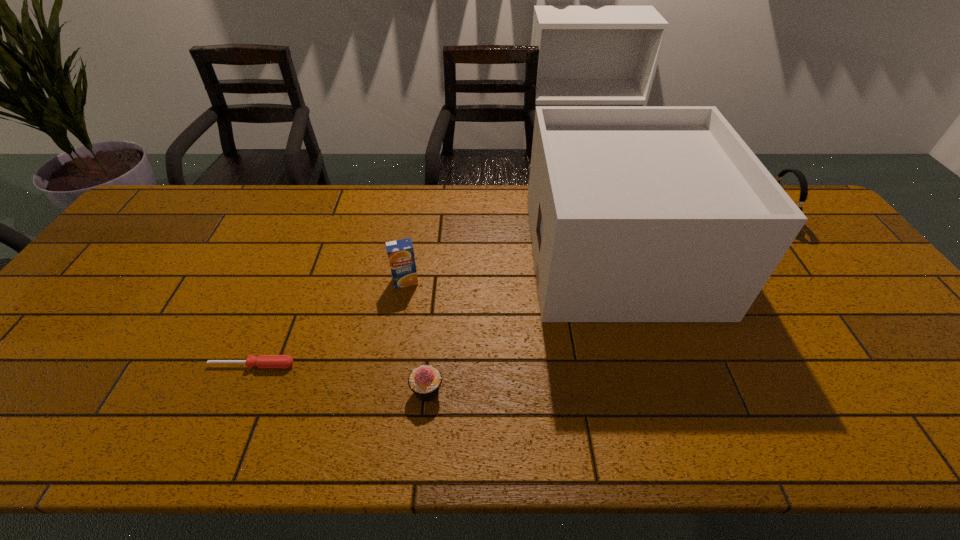
This screenshot has height=540, width=960. What are the coordinates of `free region located on the side of the tallest object with the window` in the screenshot? It's located at (403, 255).

You are a GUI agent. You are given a task and a screenshot of the screen. Output one action in this format:
    pyautogui.click(x=<x>, y=<y>)
    Task: Click on the free space located on the side of the tallest object with the window
    
    Given the screenshot: What is the action you would take?
    pyautogui.click(x=506, y=255)

Identify the location of vacant point located 0.330m on the side of the tallest object with the window. (420, 255).

The width and height of the screenshot is (960, 540). Find the location of `vacant space located 0.330m on the ear cups of the rightmost object`. vacant space located 0.330m on the ear cups of the rightmost object is located at coordinates (659, 217).

Where is `free spot located on the ear cups of the rightmost object`? free spot located on the ear cups of the rightmost object is located at coordinates coord(733,217).

Locate an element on the screen. free spot located on the ear cups of the rightmost object is located at coordinates (643, 217).

Where is `free location located 0.080m on the front of the orange_juice`? This screenshot has width=960, height=540. free location located 0.080m on the front of the orange_juice is located at coordinates (400, 312).

Identify the location of free space located on the left of the third object from left to right. The height and width of the screenshot is (540, 960). [x=366, y=391].

Find the location of `vacant area situated 0.330m on the back of the shortest object`. vacant area situated 0.330m on the back of the shortest object is located at coordinates (295, 262).

The image size is (960, 540). I want to click on box that is positioned at the far edge, so click(x=637, y=213).